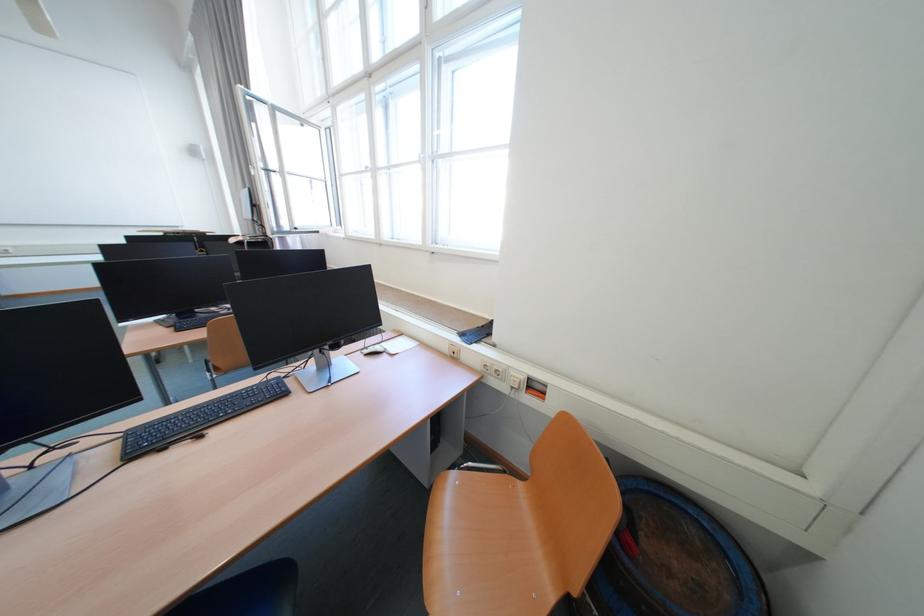
The location [373,350] corresponds to which object?

This point indicates the white computer mouse.